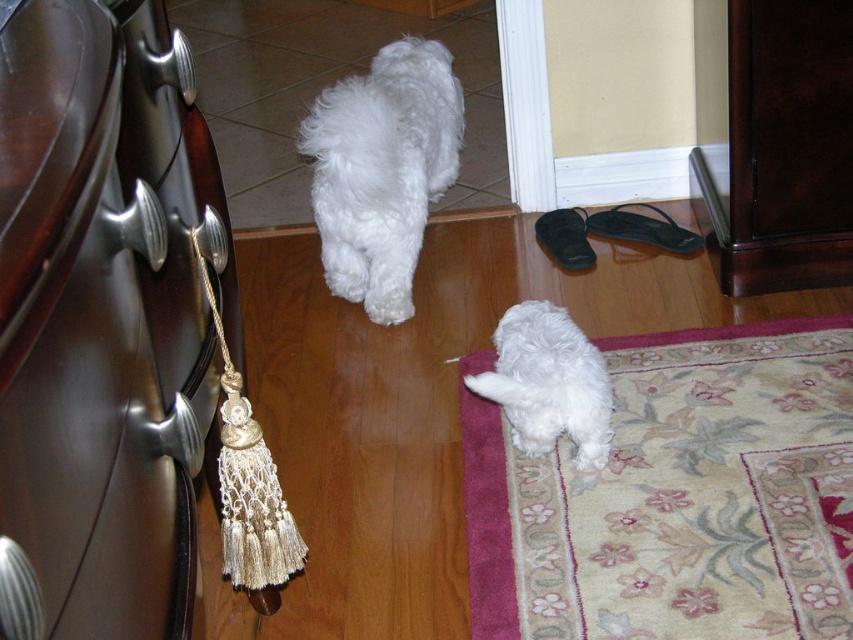
You are a delivery robot that is 1.5 meters tall. You are in the room and need to place a package on top of the dark brown wood dresser at lower right. Can you reach the top of the dresser without climbing?

The distance of dark brown wood dresser at lower right from viewer is 1.89 meters. Since the robot is 1.5 meters tall, it cannot reach the top of the dresser without climbing.

You are a small toy that wants to roll from the white fluffy dog at center to the dark brown wood dresser at lower right. Can you reach the dresser by rolling straight ahead from the dog?

The dark brown wood dresser at lower right is above the white fluffy dog at center, so rolling straight ahead from the dog would not reach the dresser since it is positioned higher up.

Looking at this image, you are a dog owner who wants to reach the shiny dark wood drawer at left located at point (86, 353). You see the two dogs in the scene. Which dog is closer to the point where the shiny dark wood drawer at left is located?

The smaller dog on the patterned rug is closer to the point where the shiny dark wood drawer at left is located because the drawer is at point (86, 353), which is closer to the rug than the doorway where the larger dog is standing.